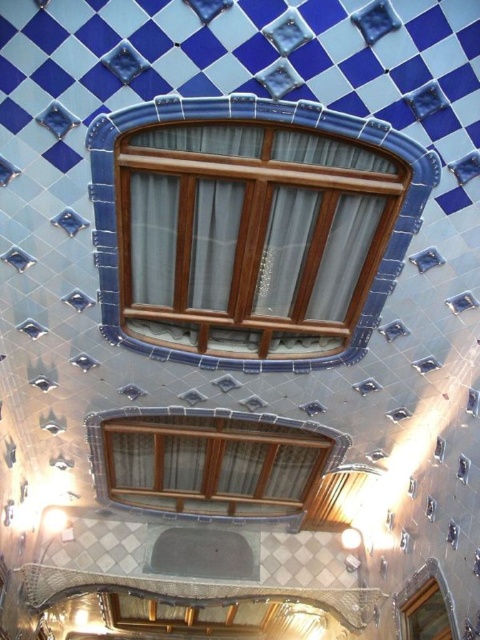
Question: Observing the image, what is the correct spatial positioning of wooden frame at center in reference to matte wood window at center?

Choices:
 (A) left
 (B) right

Answer: (B)

Question: Which point is farther to the camera?

Choices:
 (A) matte wood window at center
 (B) wooden frame at center

Answer: (A)

Question: Can you confirm if wooden frame at center is wider than matte wood window at center?

Choices:
 (A) no
 (B) yes

Answer: (A)

Question: Among these objects, which one is farthest from the camera?

Choices:
 (A) wooden frame at center
 (B) matte wood window at center

Answer: (B)

Question: Which object appears farthest from the camera in this image?

Choices:
 (A) wooden frame at center
 (B) matte wood window at center

Answer: (B)

Question: Is wooden frame at center thinner than matte wood window at center?

Choices:
 (A) yes
 (B) no

Answer: (A)